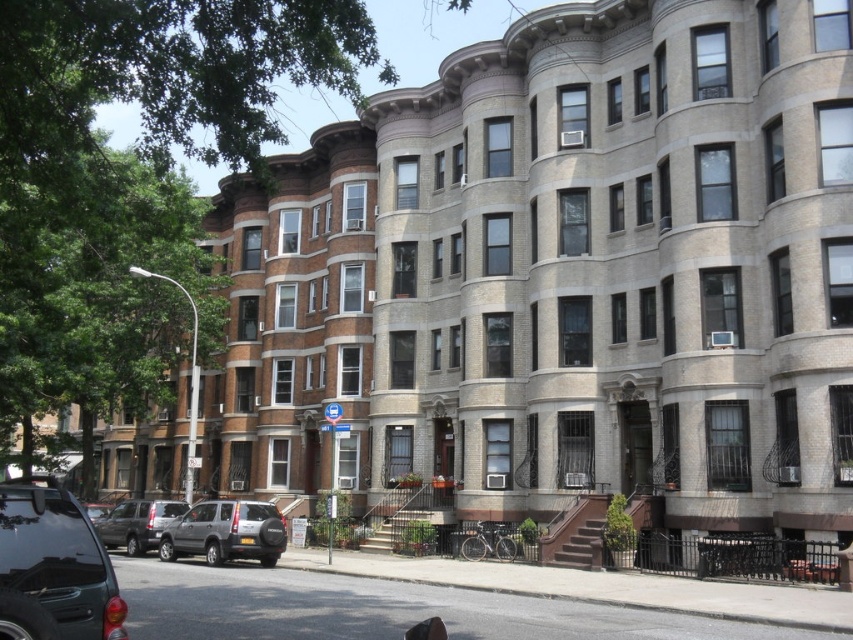
You are a delivery driver who needs to park your truck between the silver metallic suv at center and the silver metallic suv at lower left. Your truck is 2 meters wide. Can you fit your truck between them?

The silver metallic suv at center is thinner than the silver metallic suv at lower left. The distance between them is not provided, so it is impossible to determine if the truck can fit.

You are a delivery person trying to park your 2.5 meter wide van between the matte black suv at lower left and the silver metallic suv at lower left. Can you fit your van there?

The matte black suv at lower left is narrower than the silver metallic suv at lower left. The total space between them is not provided, but since the matte black suv is narrower, there might be enough space for your 2.5 meter wide van depending on the exact positioning. However, without knowing the exact distance between the vehicles, it is uncertain.

You are a delivery person trying to park your van between the matte black suv at lower left and the silver metallic suv at lower left. Which vehicle should you position your van closer to in order to fit properly?

You should position your van closer to the silver metallic suv at lower left because the matte black suv at lower left is closer to you, meaning there is more space between the two SUVs near the silver one.